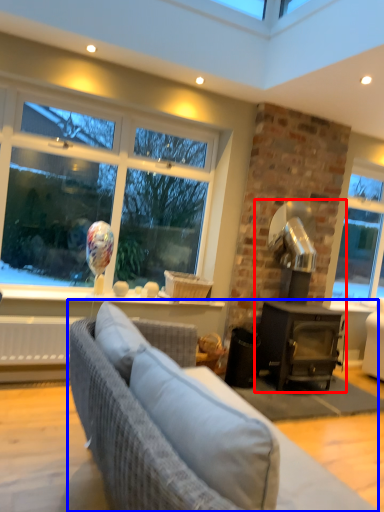
Question: Among these objects, which one is farthest to the camera, fireplace (highlighted by a red box) or studio couch (highlighted by a blue box)?

Choices:
 (A) fireplace
 (B) studio couch

Answer: (A)